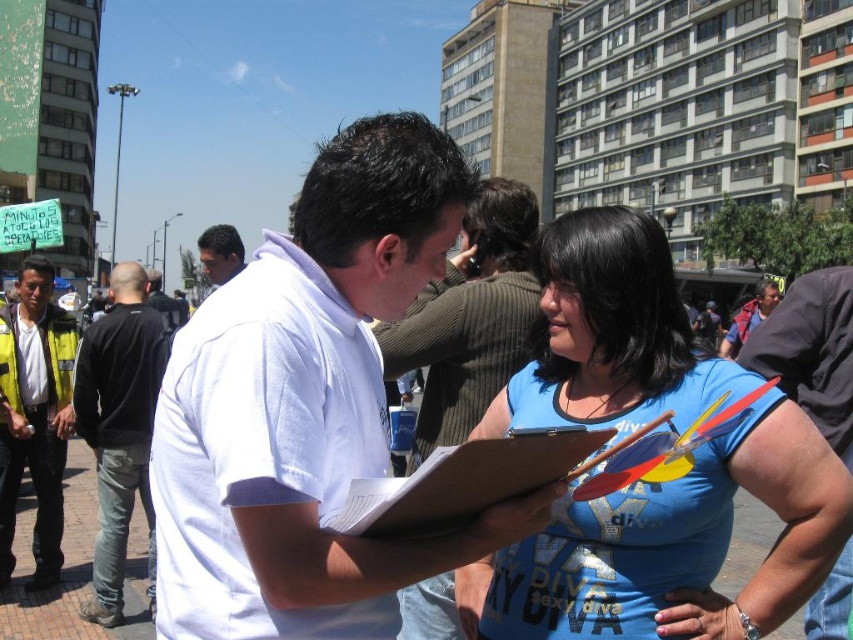
You are standing at the point with coordinates point (x=9, y=337) and want to walk to the point (x=529, y=492). Is there a clear path between these two points?

Point (x=9, y=337) is behind point (x=529, y=492), so there might be an obstruction between them. You may need to go around or check for a clear path.

You are a pedestrian trying to cross the street and see the yellow reflective vest at left and the brown cardboard clipboard at center. Which object is closer to you?

The yellow reflective vest at left is closer to you than the brown cardboard clipboard at center.

You are standing at the point marked by the coordinate point (x=672, y=547) in the image. Looking around, you see the blue cotton shirt at center. Which direction should you walk to reach the person wearing the white short sleeved shirt on the left?

The blue cotton shirt at center is located at point (x=672, y=547). To reach the person wearing the white short sleeved shirt on the left, you should walk towards the left direction from the point.